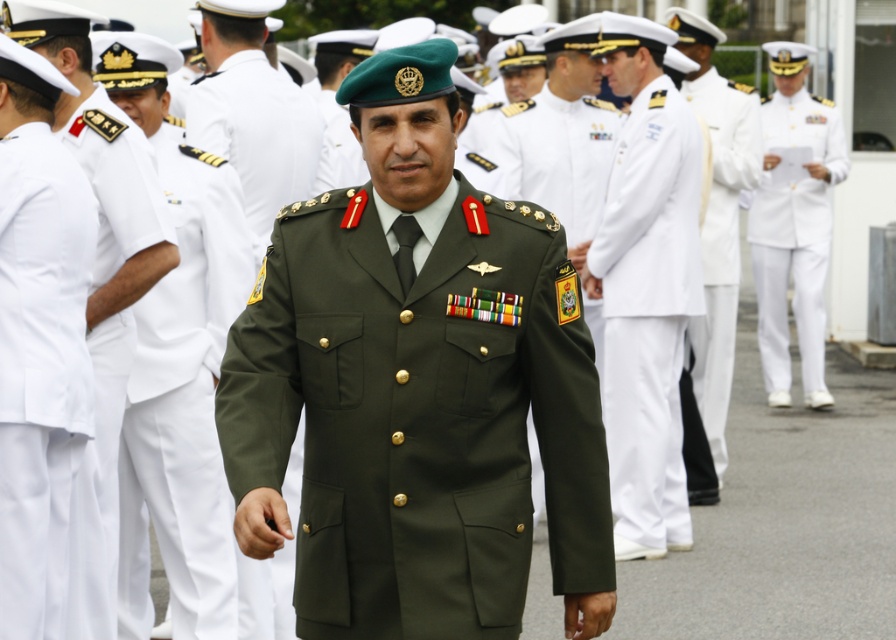
You are a tailor observing a military gathering. You need to determine which clothing item, the olive green fabric uniform at center or the white cotton pants at center, requires more fabric to make. Based on their sizes, which one would need more material?

The white cotton pants at center require more fabric because the olive green fabric uniform at center is smaller than the white cotton pants at center.

You are a photographer at the event and need to capture a photo that includes both the green matte uniform at center and the white cotton pants at left. Considering their heights, which object should be placed closer to the camera to ensure both are fully visible in the frame?

The green matte uniform at center is taller than the white cotton pants at left. To ensure both are fully visible, position the taller green matte uniform at center closer to the camera so its full height fits within the frame while the shorter white cotton pants at left can be seen in the background.